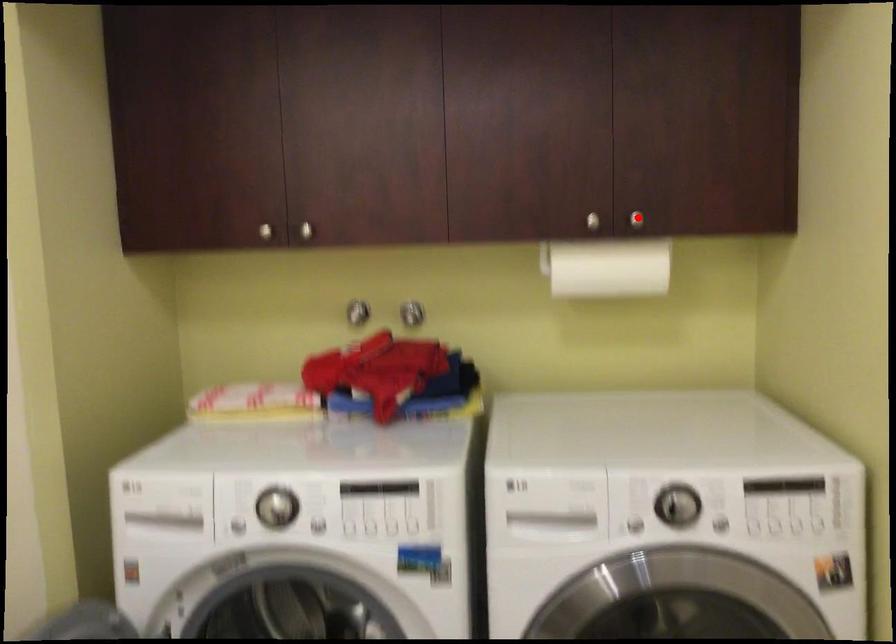
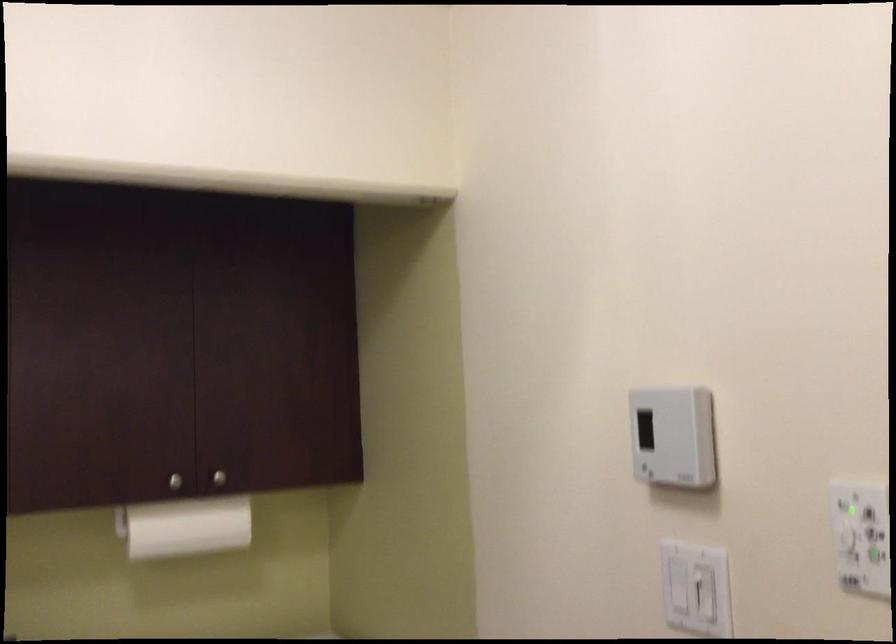
Locate, in the second image, the point that corresponds to the highlighted location in the first image.

(219, 478)